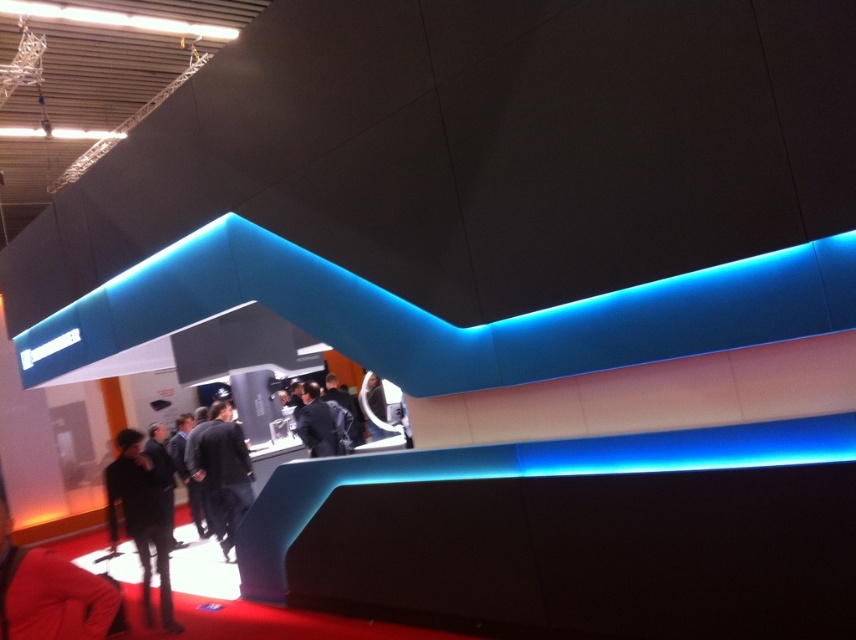
Can you confirm if black fabric coat at lower left is smaller than black fabric suit at center?

Yes, black fabric coat at lower left is smaller than black fabric suit at center.

Who is shorter, black fabric coat at lower left or black fabric suit at center?

Standing shorter between the two is black fabric coat at lower left.

Which is in front, point (117, 470) or point (230, 424)?

Point (117, 470) is in front.

Find the location of a particular element. This screenshot has height=640, width=856. black fabric coat at lower left is located at coordinates pos(140,518).

Can you confirm if black fabric suit at center is smaller than black suit at center?

Actually, black fabric suit at center might be larger than black suit at center.

Between black fabric suit at center and black suit at center, which one has more height?

black fabric suit at center

Does point (227, 538) come behind point (314, 419)?

Yes, it is behind point (314, 419).

Find the location of `black fabric suit at center`. black fabric suit at center is located at coordinates (223, 468).

Is black fabric coat at lower left further to camera compared to black suit at center?

That is False.

Is black fabric coat at lower left wider than black suit at center?

Yes, black fabric coat at lower left is wider than black suit at center.

Locate an element on the screen. This screenshot has width=856, height=640. black fabric coat at lower left is located at coordinates [x=140, y=518].

This screenshot has width=856, height=640. In order to click on black fabric coat at lower left in this screenshot , I will do `click(140, 518)`.